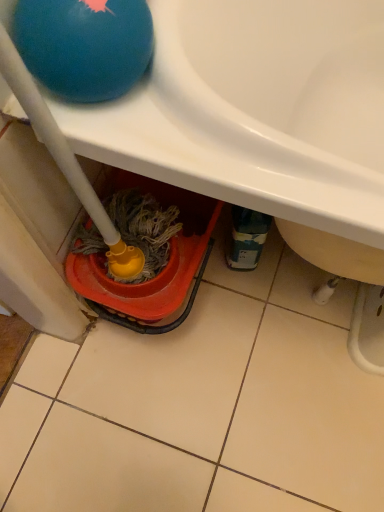
The height and width of the screenshot is (512, 384). I want to click on vacant space to the right of blue rubber ball at upper left, so click(x=217, y=128).